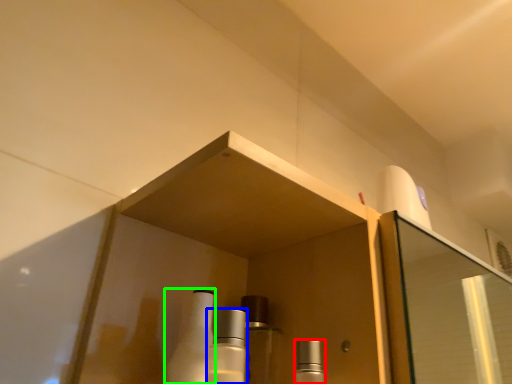
Question: Based on their relative distances, which object is farther from mouthwash (highlighted by a red box)? Choose from mouthwash (highlighted by a blue box) and bottle (highlighted by a green box).

Choices:
 (A) mouthwash
 (B) bottle

Answer: (B)